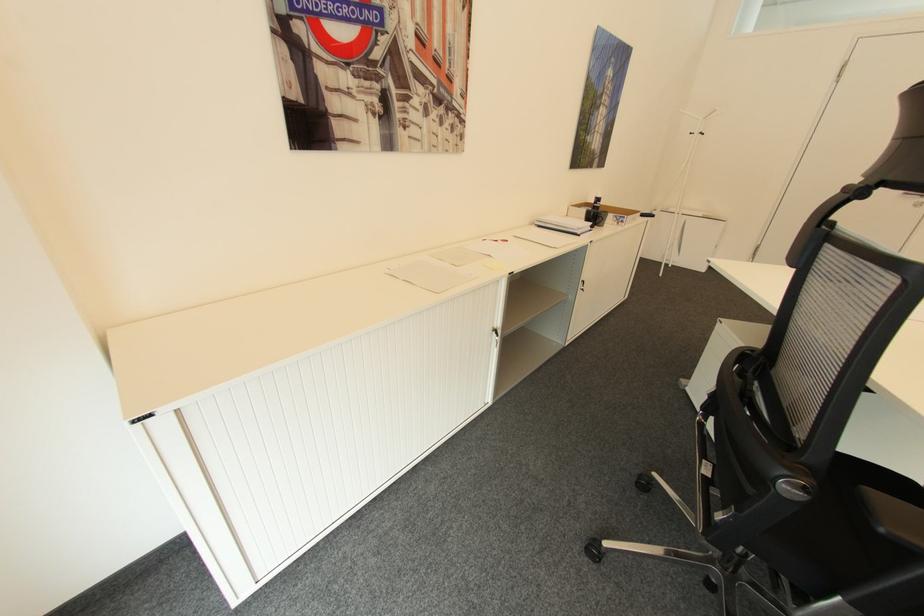
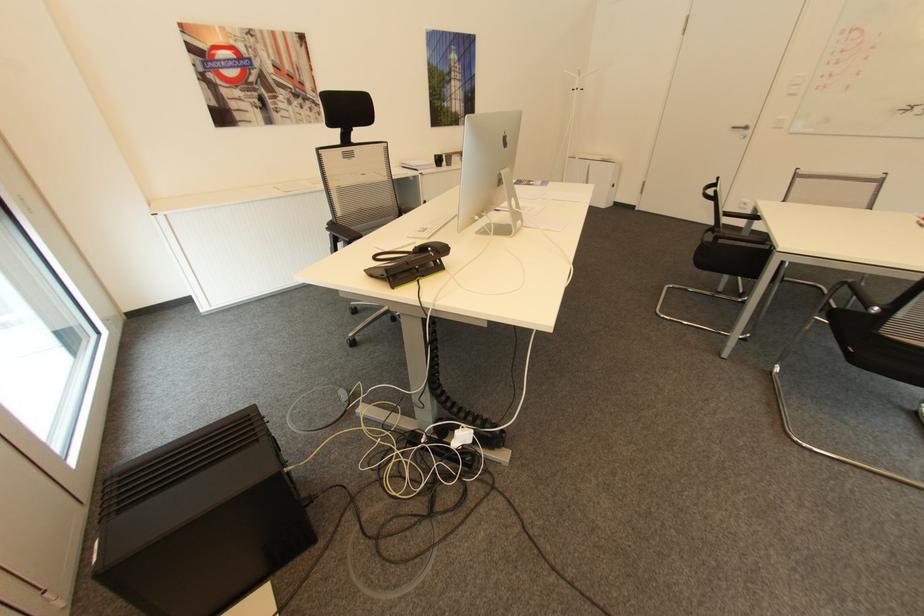
Where in the second image is the point corresponding to (x=467, y=116) from the first image?

(322, 102)